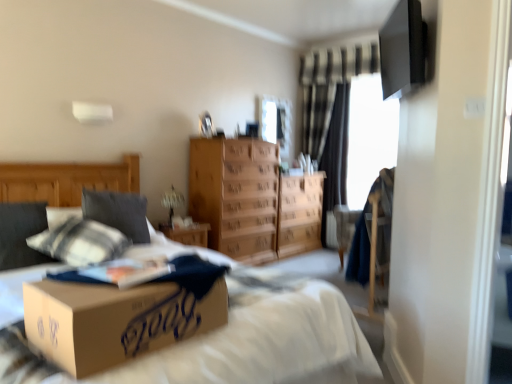
Question: Can you confirm if light brown wood chest of drawers at center is wider than soft gray pillow at left?

Choices:
 (A) yes
 (B) no

Answer: (A)

Question: Considering the relative sizes of light brown wood chest of drawers at center and soft gray pillow at left in the image provided, is light brown wood chest of drawers at center bigger than soft gray pillow at left?

Choices:
 (A) no
 (B) yes

Answer: (B)

Question: From a real-world perspective, does light brown wood chest of drawers at center stand above soft gray pillow at left?

Choices:
 (A) no
 (B) yes

Answer: (A)

Question: Considering the relative positions of light brown wood chest of drawers at center and soft gray pillow at left in the image provided, is light brown wood chest of drawers at center behind soft gray pillow at left?

Choices:
 (A) no
 (B) yes

Answer: (B)

Question: Is light brown wood chest of drawers at center next to soft gray pillow at left?

Choices:
 (A) no
 (B) yes

Answer: (A)

Question: Can you confirm if light brown wood chest of drawers at center is thinner than soft gray pillow at left?

Choices:
 (A) no
 (B) yes

Answer: (A)

Question: Does wooden dresser at center contain transparent glass window screen at upper right, the second window screen positioned from the left?

Choices:
 (A) yes
 (B) no

Answer: (B)

Question: Is wooden dresser at center oriented towards transparent glass window screen at upper right, the second window screen positioned from the left?

Choices:
 (A) no
 (B) yes

Answer: (A)

Question: From a real-world perspective, is wooden dresser at center located beneath transparent glass window screen at upper right, the second window screen positioned from the left?

Choices:
 (A) no
 (B) yes

Answer: (B)

Question: From a real-world perspective, does wooden dresser at center stand above transparent glass window screen at upper right, the second window screen positioned from the left?

Choices:
 (A) no
 (B) yes

Answer: (A)

Question: Is wooden dresser at center positioned beyond the bounds of transparent glass window screen at upper right, positioned as the 1th window screen in right-to-left order?

Choices:
 (A) no
 (B) yes

Answer: (B)

Question: From the image's perspective, is wooden dresser at center on top of transparent glass window screen at upper right, positioned as the 1th window screen in right-to-left order?

Choices:
 (A) no
 (B) yes

Answer: (A)

Question: Is soft gray pillow at left far from wooden dresser at center?

Choices:
 (A) no
 (B) yes

Answer: (B)